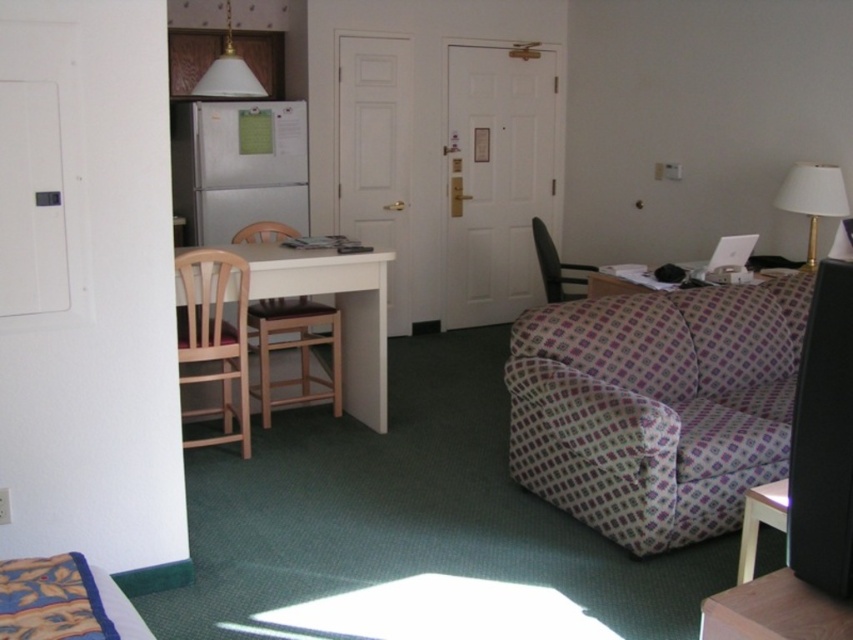
Question: Observing the image, what is the correct spatial positioning of patterned fabric couch at right in reference to matte black chair at center?

Choices:
 (A) right
 (B) left

Answer: (A)

Question: Which point is closer to the camera?

Choices:
 (A) (247, 429)
 (B) (822, 202)
 (C) (363, 257)
 (D) (578, 292)

Answer: (A)

Question: Which object appears farthest from the camera in this image?

Choices:
 (A) white wood table at center
 (B) wooden table at lower right
 (C) light brown wood chair at left
 (D) white fabric lampshade at upper right

Answer: (D)

Question: Among these points, which one is farthest from the camera?

Choices:
 (A) (357, 260)
 (B) (563, 268)
 (C) (212, 252)
 (D) (206, 90)

Answer: (B)

Question: Does patterned fabric couch at right appear on the left side of white wood table at center?

Choices:
 (A) no
 (B) yes

Answer: (A)

Question: Does white wood table at center have a larger size compared to plaid fabric couch at right?

Choices:
 (A) no
 (B) yes

Answer: (B)